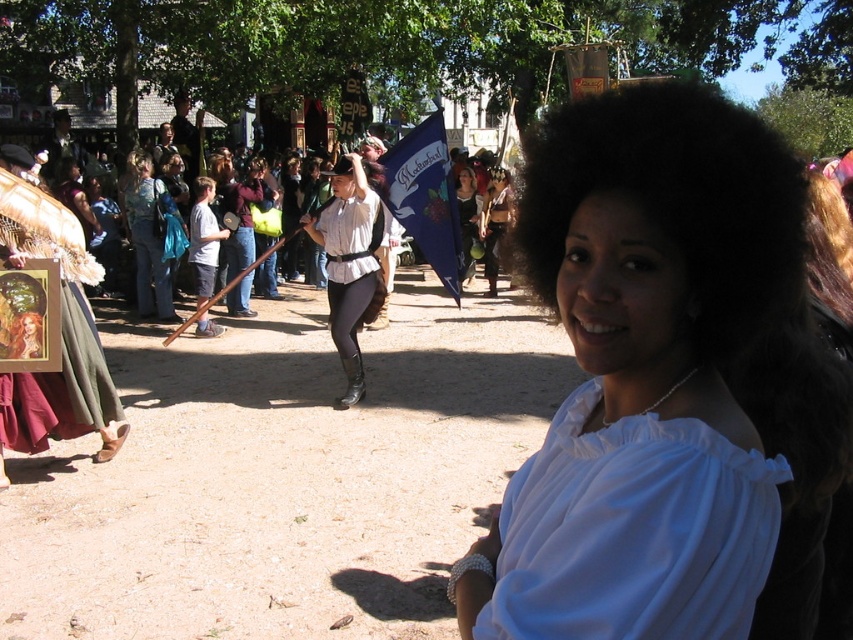
Question: Can you confirm if white satin blouse at center is positioned above matte black dress at center?

Choices:
 (A) no
 (B) yes

Answer: (A)

Question: Which point is closer to the camera?

Choices:
 (A) matte brown hair at center
 (B) blue fabric flag at center
 (C) white satin blouse at center

Answer: (C)

Question: Estimate the real-world distances between objects in this image. Which object is closer to the matte brown hair at center?

Choices:
 (A) white satin dress at center
 (B) blue fabric flag at center
 (C) matte black dress at center

Answer: (C)

Question: Is the position of white satin dress at center less distant than that of blue fabric flag at center?

Choices:
 (A) no
 (B) yes

Answer: (B)

Question: Where is white satin dress at center located in relation to blue fabric flag at center in the image?

Choices:
 (A) below
 (B) above

Answer: (A)

Question: Which point is farther from the camera taking this photo?

Choices:
 (A) (486, 252)
 (B) (672, 227)
 (C) (606, 448)

Answer: (A)